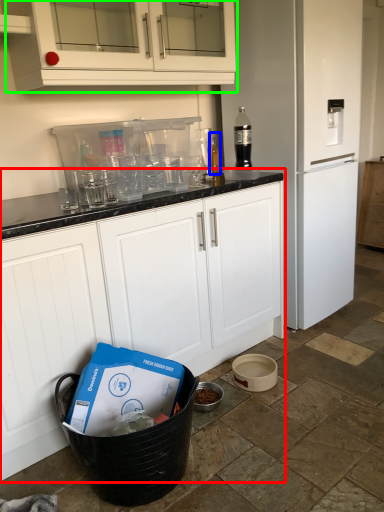
Question: Based on their relative distances, which object is nearer to cabinetry (highlighted by a red box)? Choose from bottle (highlighted by a blue box) and cabinetry (highlighted by a green box).

Choices:
 (A) bottle
 (B) cabinetry

Answer: (B)